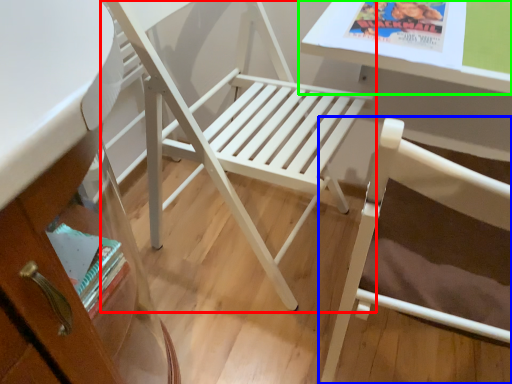
Question: Which object is the farthest from chair (highlighted by a red box)? Choose among these: chair (highlighted by a blue box) or table (highlighted by a green box).

Choices:
 (A) chair
 (B) table

Answer: (A)